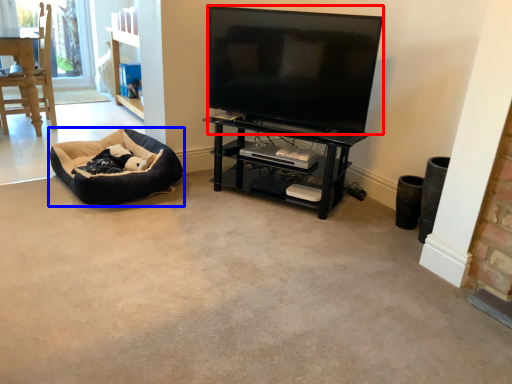
Question: Among these objects, which one is farthest to the camera, television (highlighted by a red box) or dog bed (highlighted by a blue box)?

Choices:
 (A) television
 (B) dog bed

Answer: (B)